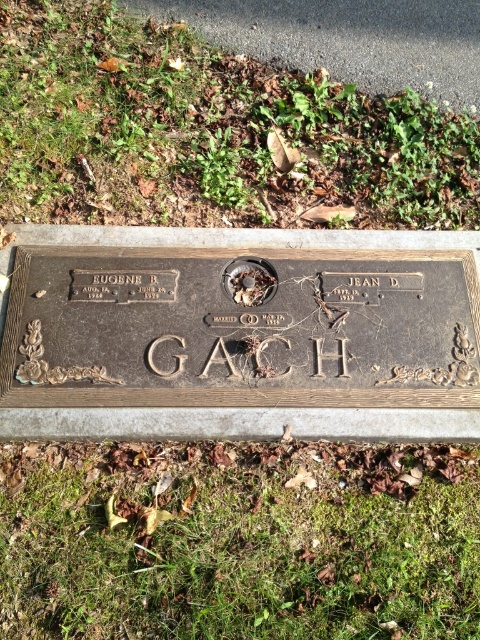
From the picture: You are standing in front of a bronze plaque on a concrete base outdoors. The plaque commemorates Eugene B. Gach and Jean D. Gach. There is green grass at lower center. Where exactly is the green grass located in relation to the plaque?

The green grass at lower center is located at point coordinates of (x=240, y=541).

Consider the image. You are standing in front of the bronze plaque on the concrete base. There is a point marked at coordinates [240,541]. What is located at that point?

The point at coordinates [240,541] marks green grass at lower center.